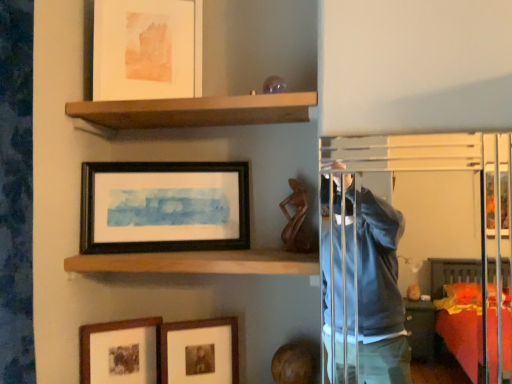
Question: From a real-world perspective, is matte wooden picture frame at lower center, which appears as the 2th picture frame when ordered from the bottom, positioned under matte paper picture frame at upper center, the first picture frame when ordered from top to bottom, based on gravity?

Choices:
 (A) no
 (B) yes

Answer: (B)

Question: Does matte wooden picture frame at lower center, which appears as the 2th picture frame when ordered from the bottom, have a larger size compared to matte paper picture frame at upper center, the first picture frame when ordered from top to bottom?

Choices:
 (A) no
 (B) yes

Answer: (A)

Question: Does matte wooden picture frame at lower center, which appears as the 2th picture frame when ordered from the bottom, touch matte paper picture frame at upper center, the 4th picture frame in the bottom-to-top sequence?

Choices:
 (A) yes
 (B) no

Answer: (B)

Question: Does matte wooden picture frame at lower center, acting as the third picture frame starting from the top, have a greater width compared to matte paper picture frame at upper center, the first picture frame when ordered from top to bottom?

Choices:
 (A) no
 (B) yes

Answer: (B)

Question: Is matte wooden picture frame at lower center, which appears as the 2th picture frame when ordered from the bottom, to the right of matte paper picture frame at upper center, the 4th picture frame in the bottom-to-top sequence, from the viewer's perspective?

Choices:
 (A) no
 (B) yes

Answer: (B)

Question: From the image's perspective, is matte wooden picture frame at lower center, which appears as the 2th picture frame when ordered from the bottom, above or below transparent glass door at upper right?

Choices:
 (A) above
 (B) below

Answer: (B)

Question: From a real-world perspective, is matte wooden picture frame at lower center, acting as the third picture frame starting from the top, physically located above or below transparent glass door at upper right?

Choices:
 (A) below
 (B) above

Answer: (A)

Question: Based on their sizes in the image, would you say matte wooden picture frame at lower center, acting as the third picture frame starting from the top, is bigger or smaller than transparent glass door at upper right?

Choices:
 (A) big
 (B) small

Answer: (B)

Question: Is matte wooden picture frame at lower center, acting as the third picture frame starting from the top, in front of or behind transparent glass door at upper right in the image?

Choices:
 (A) front
 (B) behind

Answer: (B)

Question: From a real-world perspective, relative to brown wooden shelf at upper center, which is the 1th shelf from top to bottom, is transparent glass door at upper right vertically above or below?

Choices:
 (A) below
 (B) above

Answer: (A)

Question: Do you think transparent glass door at upper right is within brown wooden shelf at upper center, which is the 1th shelf from top to bottom, or outside of it?

Choices:
 (A) inside
 (B) outside

Answer: (B)

Question: Considering the positions of transparent glass door at upper right and brown wooden shelf at upper center, which is the 1th shelf from top to bottom, in the image, is transparent glass door at upper right taller or shorter than brown wooden shelf at upper center, which is the 1th shelf from top to bottom,?

Choices:
 (A) short
 (B) tall

Answer: (B)

Question: Relative to brown wooden shelf at upper center, the 2th shelf in the bottom-to-top sequence, is transparent glass door at upper right in front or behind?

Choices:
 (A) behind
 (B) front

Answer: (B)

Question: From the image's perspective, relative to brown wooden shelf at upper center, the 2th shelf in the bottom-to-top sequence, is black matte picture frame at center, acting as the 3th picture frame starting from the bottom, above or below?

Choices:
 (A) above
 (B) below

Answer: (B)

Question: In the image, is black matte picture frame at center, arranged as the 2th picture frame when viewed from the top, positioned in front of or behind brown wooden shelf at upper center, which is the 1th shelf from top to bottom?

Choices:
 (A) behind
 (B) front

Answer: (A)